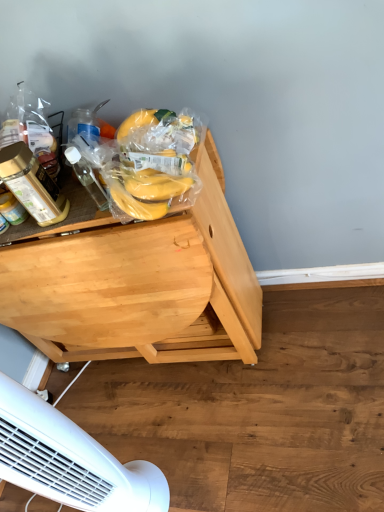
Image resolution: width=384 pixels, height=512 pixels. I want to click on unoccupied space behind white plastic mechanical fan at lower left, so click(x=132, y=425).